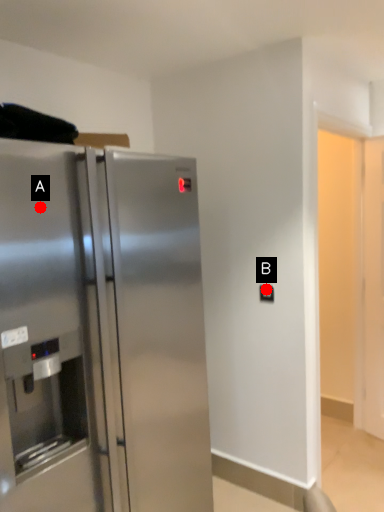
Question: Two points are circled on the image, labeled by A and B beside each circle. Which point is closer to the camera?

Choices:
 (A) A is closer
 (B) B is closer

Answer: (A)